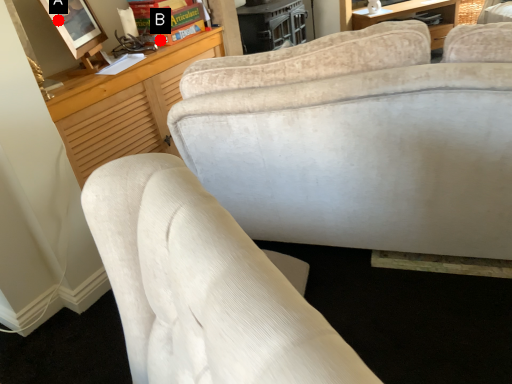
Question: Two points are circled on the image, labeled by A and B beside each circle. Which point is closer to the camera?

Choices:
 (A) A is closer
 (B) B is closer

Answer: (A)